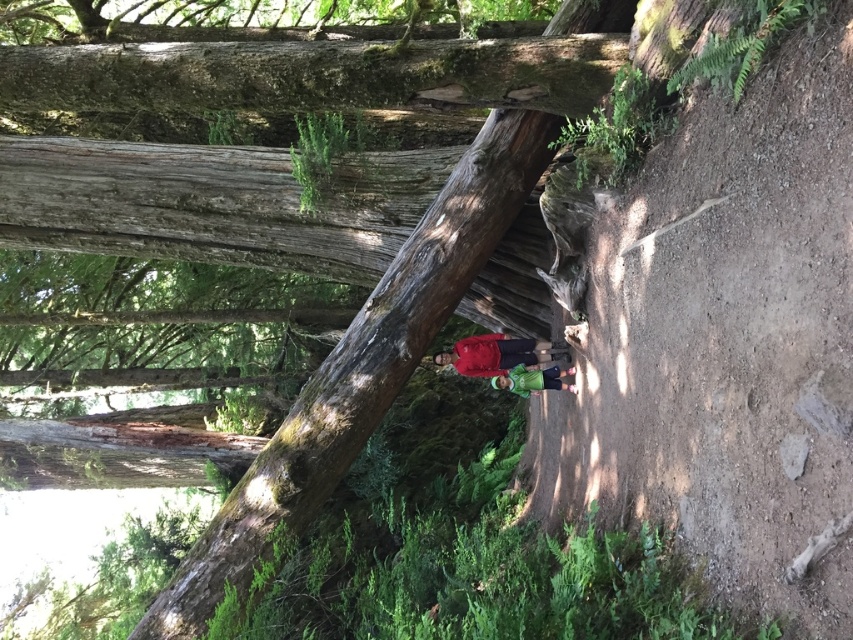
Question: Which object is farther from the camera taking this photo?

Choices:
 (A) smooth brown log at center
 (B) green matte shirt at center
 (C) red fabric jacket at center

Answer: (C)

Question: Which of the following is the farthest from the observer?

Choices:
 (A) red fabric jacket at center
 (B) green matte shirt at center
 (C) smooth brown log at center

Answer: (A)

Question: Is red fabric jacket at center to the left of green matte shirt at center from the viewer's perspective?

Choices:
 (A) yes
 (B) no

Answer: (A)

Question: Which of these objects is positioned farthest from the green matte shirt at center?

Choices:
 (A) smooth brown log at center
 (B) red fabric jacket at center

Answer: (A)

Question: Can you confirm if smooth brown log at center is positioned below green matte shirt at center?

Choices:
 (A) yes
 (B) no

Answer: (B)

Question: Observing the image, what is the correct spatial positioning of smooth brown log at center in reference to green matte shirt at center?

Choices:
 (A) below
 (B) above

Answer: (B)